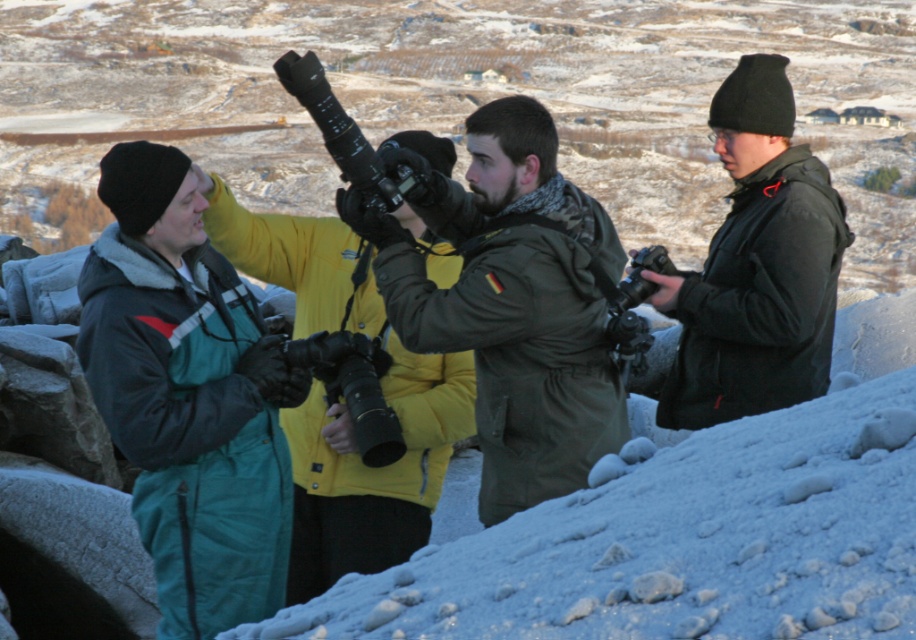
Question: Is teal snowsuit at left to the left of matte black jacket at right from the viewer's perspective?

Choices:
 (A) no
 (B) yes

Answer: (B)

Question: Does teal snowsuit at left appear over matte black jacket at right?

Choices:
 (A) no
 (B) yes

Answer: (A)

Question: Which object is the closest to the matte green jacket at center?

Choices:
 (A) teal snowsuit at left
 (B) matte black jacket at right

Answer: (A)

Question: Which point is farther to the camera?

Choices:
 (A) 812,160
 (B) 388,493

Answer: (A)

Question: Which of the following is the closest to the observer?

Choices:
 (A) (362, 262)
 (B) (592, 204)
 (C) (129, 154)
 (D) (725, 236)

Answer: (C)

Question: Is teal snowsuit at left positioned in front of matte green jacket at center?

Choices:
 (A) yes
 (B) no

Answer: (A)